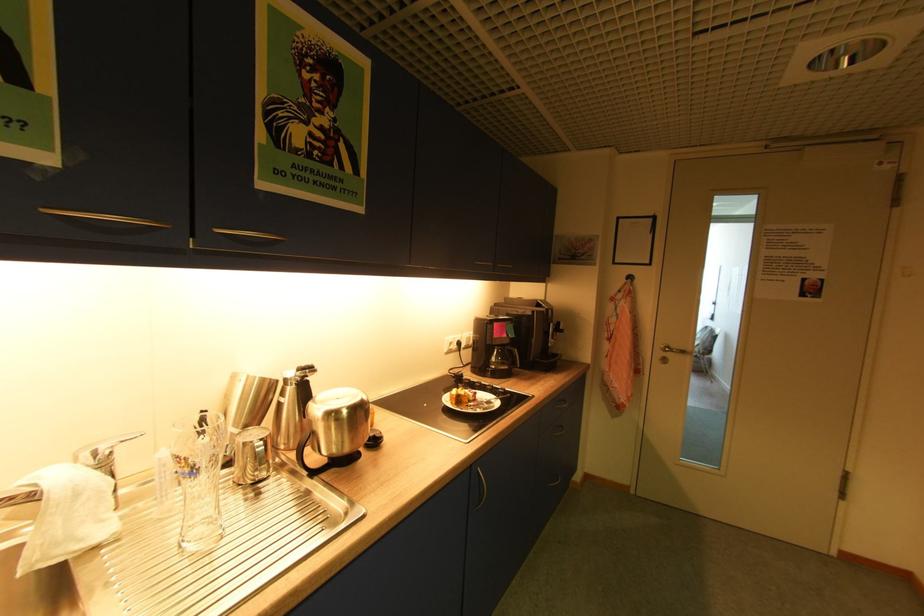
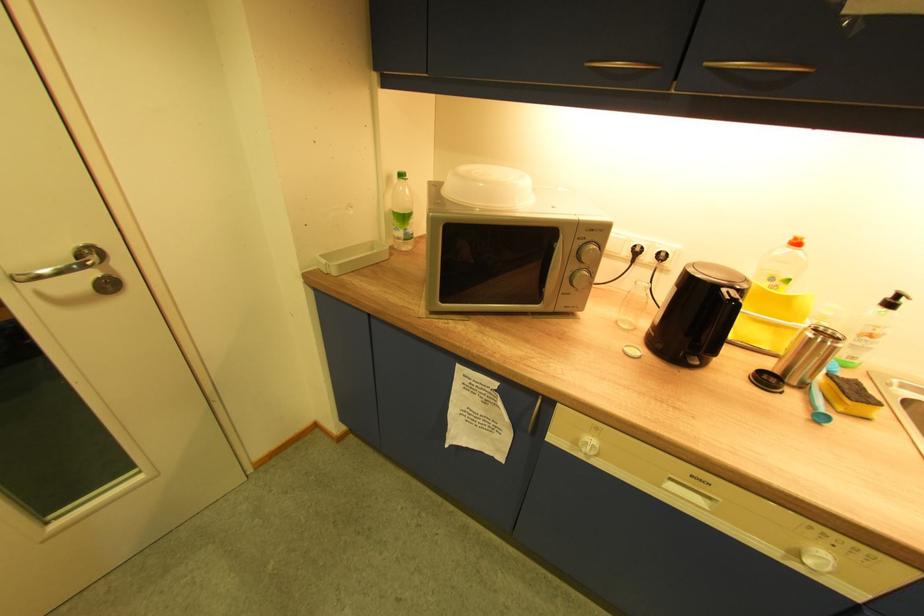
The first image is from the beginning of the video and the second image is from the end. How did the camera likely rotate when shooting the video?

The camera rotated toward left-down.